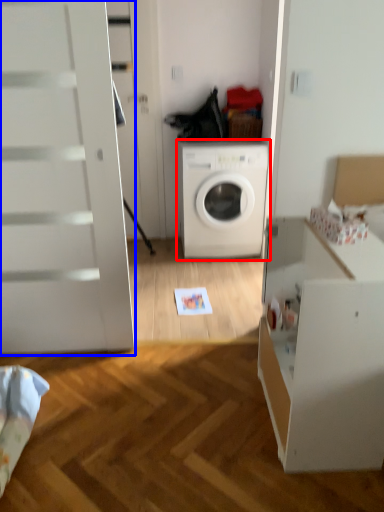
Question: Among these objects, which one is nearest to the camera, washing machine (highlighted by a red box) or screen door (highlighted by a blue box)?

Choices:
 (A) washing machine
 (B) screen door

Answer: (B)